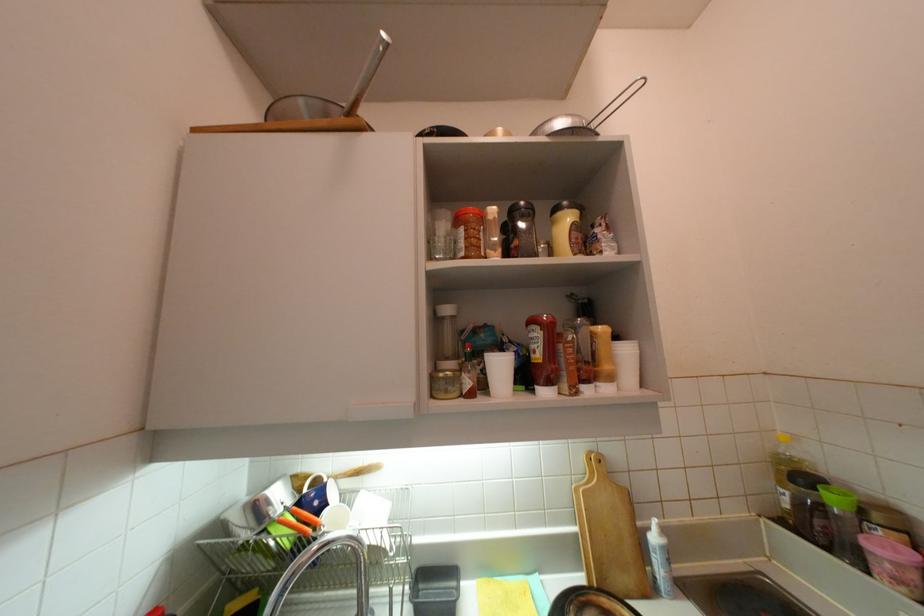
Describe the element at coordinates (788, 447) in the screenshot. The height and width of the screenshot is (616, 924). I see `the clear bottle pump` at that location.